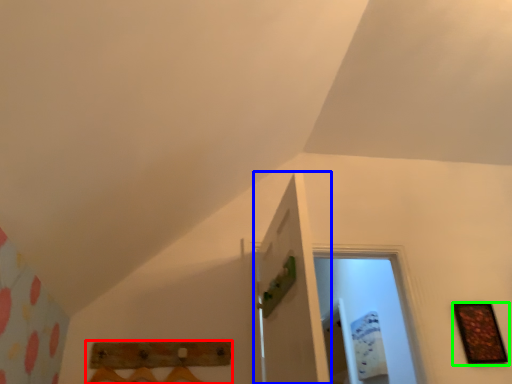
Question: Which object is the closest to the furniture (highlighted by a red box)? Choose among these: door (highlighted by a blue box) or picture frame (highlighted by a green box).

Choices:
 (A) door
 (B) picture frame

Answer: (A)